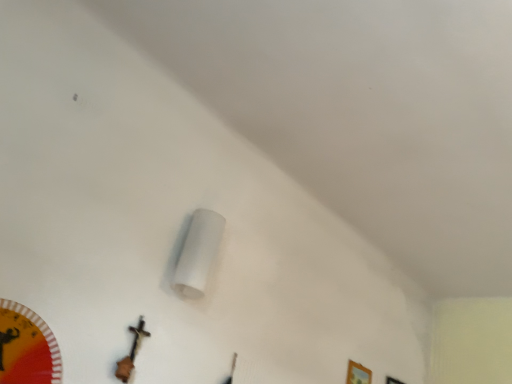
Measure the distance between point (131,367) and camera.

1.42 meters.

Image resolution: width=512 pixels, height=384 pixels. What do you see at coordinates (131, 352) in the screenshot?
I see `wooden crucifix at lower left` at bounding box center [131, 352].

Image resolution: width=512 pixels, height=384 pixels. Find the location of `wooden crucifix at lower left`. wooden crucifix at lower left is located at coordinates (131, 352).

Find the location of a particular element. wooden crucifix at lower left is located at coordinates (131, 352).